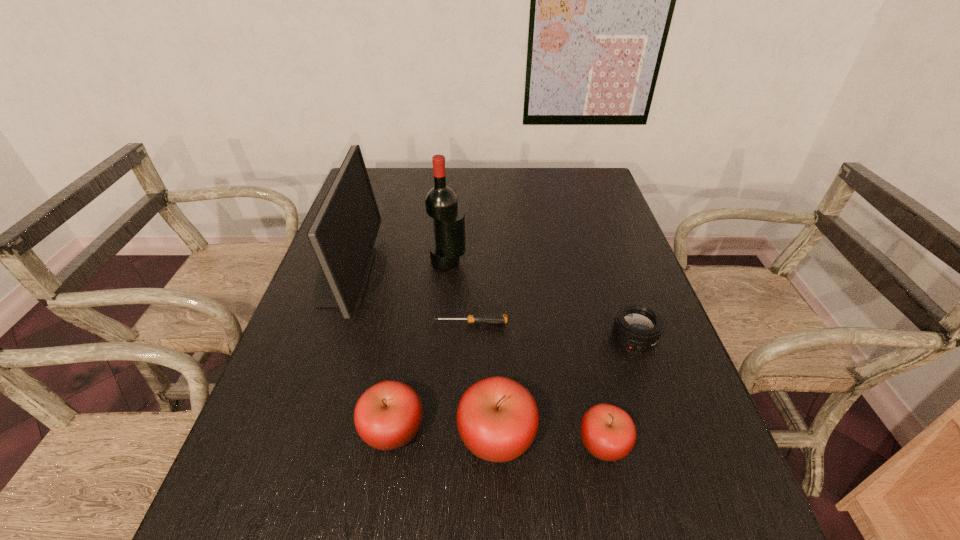
Find the location of a particular element. telephoto lens at the right edge is located at coordinates (637, 326).

You are a GUI agent. You are given a task and a screenshot of the screen. Output one action in this format:
    pyautogui.click(x=<x>, y=<y>)
    Task: Click on the object that is at the near right corner
    
    Given the screenshot: What is the action you would take?
    pyautogui.click(x=608, y=432)

I want to click on vacant space at the far edge, so click(x=499, y=168).

Locate an element on the screen. Image resolution: width=960 pixels, height=540 pixels. free space at the near edge of the desktop is located at coordinates (562, 461).

The height and width of the screenshot is (540, 960). In the image, there is a desktop. Find the location of `vacant area at the left edge`. vacant area at the left edge is located at coordinates (290, 357).

Where is `free location at the right edge of the desktop`? The width and height of the screenshot is (960, 540). free location at the right edge of the desktop is located at coordinates (625, 269).

At what (x,y) coordinates should I click in order to perform the action: click on free point at the far right corner. Please return your answer as a coordinate pair (x, y). This screenshot has width=960, height=540. Looking at the image, I should click on (607, 187).

Where is `free region at the near right corner of the desktop`? free region at the near right corner of the desktop is located at coordinates (636, 454).

Find the location of a particular element. Image resolution: width=960 pixels, height=540 pixels. blank region between the rightmost object and the computer monitor is located at coordinates (489, 307).

This screenshot has width=960, height=540. I want to click on empty location between the rightmost apple and the wine bottle, so click(x=526, y=353).